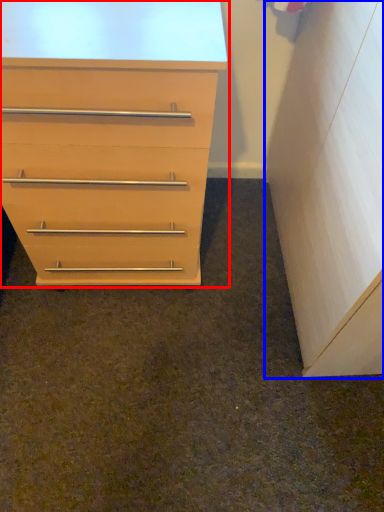
Question: Which object is further to the camera taking this photo, chest of drawers (highlighted by a red box) or file cabinet (highlighted by a blue box)?

Choices:
 (A) chest of drawers
 (B) file cabinet

Answer: (A)